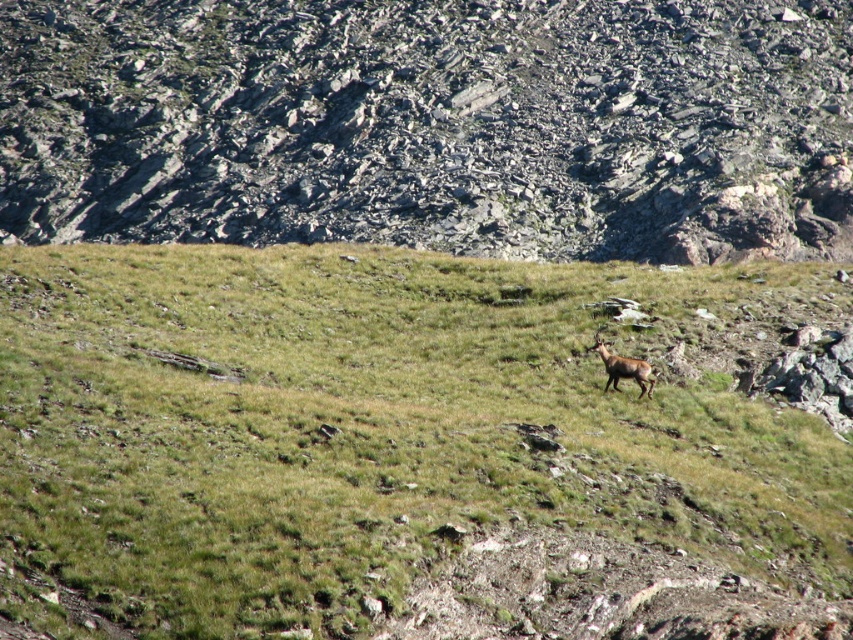
In the scene shown: Can you confirm if green grassy at center is shorter than brown furry deer at center-right?

Incorrect, green grassy at center's height does not fall short of brown furry deer at center-right's.

Consider the image. Can you confirm if green grassy at center is taller than brown furry deer at center-right?

Correct, green grassy at center is much taller as brown furry deer at center-right.

Measure the distance between point (314, 465) and camera.

A distance of 29.25 meters exists between point (314, 465) and camera.

In order to click on green grassy at center in this screenshot , I will do `click(392, 440)`.

Is green grassy at center to the right of gray rock at upper center from the viewer's perspective?

In fact, green grassy at center is to the left of gray rock at upper center.

Who is positioned more to the right, green grassy at center or gray rock at upper center?

gray rock at upper center

Which is behind, point (642, 340) or point (344, 26)?

The point (344, 26) is more distant.

Image resolution: width=853 pixels, height=640 pixels. I want to click on green grassy at center, so click(392, 440).

Can you confirm if gray rock at upper center is positioned to the right of brown furry deer at center-right?

Incorrect, gray rock at upper center is not on the right side of brown furry deer at center-right.

I want to click on gray rock at upper center, so click(433, 124).